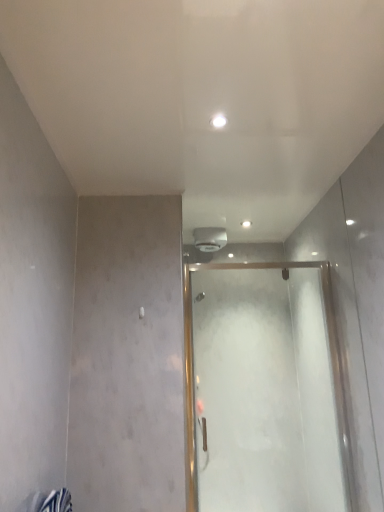
Find the location of a particular element. The image size is (384, 512). frosted glass door at center is located at coordinates (262, 390).

The image size is (384, 512). What do you see at coordinates (262, 390) in the screenshot? I see `frosted glass door at center` at bounding box center [262, 390].

Describe the element at coordinates (218, 121) in the screenshot. I see `white glossy light at center` at that location.

At what (x,y) coordinates should I click in order to perform the action: click on white glossy light at center. Please return your answer as a coordinate pair (x, y). Looking at the image, I should click on (218, 121).

Image resolution: width=384 pixels, height=512 pixels. What are the coordinates of `frosted glass door at center` in the screenshot? It's located at (262, 390).

Can you confirm if white glossy light at center is positioned to the right of frosted glass door at center?

No, white glossy light at center is not to the right of frosted glass door at center.

Is white glossy light at center positioned in front of frosted glass door at center?

Yes, the depth of white glossy light at center is less than that of frosted glass door at center.

Which is closer to the camera, (212, 120) or (228, 437)?

The point (212, 120) is in front.

From the image's perspective, which is below, white glossy light at center or frosted glass door at center?

frosted glass door at center is shown below in the image.

From a real-world perspective, is white glossy light at center above or below frosted glass door at center?

From a real-world perspective, white glossy light at center is physically above frosted glass door at center.

Which of these two, white glossy light at center or frosted glass door at center, is wider?

white glossy light at center.

Who is shorter, white glossy light at center or frosted glass door at center?

Standing shorter between the two is white glossy light at center.

Does white glossy light at center have a smaller size compared to frosted glass door at center?

Correct, white glossy light at center occupies less space than frosted glass door at center.

Is white glossy light at center outside of frosted glass door at center?

Yes, white glossy light at center is located beyond the bounds of frosted glass door at center.

Is white glossy light at center not close to frosted glass door at center?

Yes, white glossy light at center is far from frosted glass door at center.

Is white glossy light at center facing towards frosted glass door at center?

No, white glossy light at center is not aimed at frosted glass door at center.

Can you tell me how much white glossy light at center and frosted glass door at center differ in facing direction?

There is a 2.01-degree angle between the facing directions of white glossy light at center and frosted glass door at center.

Identify the location of light on the left of the frosted glass door at center. This screenshot has height=512, width=384. (218, 121).

Considering the relative positions of frosted glass door at center and white glossy light at center in the image provided, is frosted glass door at center to the left of white glossy light at center from the viewer's perspective?

No.

Which object is further away from the camera, frosted glass door at center or white glossy light at center?

Positioned behind is frosted glass door at center.

Which is farther from the camera, (257, 452) or (219, 121)?

Answer: The point (257, 452) is farther.

From the image's perspective, which object appears higher, frosted glass door at center or white glossy light at center?

white glossy light at center is shown above in the image.

From a real-world perspective, is frosted glass door at center above or below white glossy light at center?

frosted glass door at center is situated lower than white glossy light at center in the real world.

Is frosted glass door at center wider than white glossy light at center?

In fact, frosted glass door at center might be narrower than white glossy light at center.

Does frosted glass door at center have a lesser height compared to white glossy light at center?

No.

Between frosted glass door at center and white glossy light at center, which one has smaller size?

With smaller size is white glossy light at center.

Choose the correct answer: Is frosted glass door at center inside white glossy light at center or outside it?

frosted glass door at center is not inside white glossy light at center, it's outside.

Are frosted glass door at center and white glossy light at center beside each other?

No, frosted glass door at center is not next to white glossy light at center.

Is frosted glass door at center oriented towards white glossy light at center?

No.

Can you tell me how much frosted glass door at center and white glossy light at center differ in facing direction?

The angular difference between frosted glass door at center and white glossy light at center is 2.01 degrees.

Where is `light on the left of frosted glass door at center`? The height and width of the screenshot is (512, 384). light on the left of frosted glass door at center is located at coordinates (218, 121).

In the image, there is a white glossy light at center. In order to click on glass door below it (from the image's perspective) in this screenshot , I will do `click(262, 390)`.

I want to click on glass door on the right of white glossy light at center, so click(x=262, y=390).